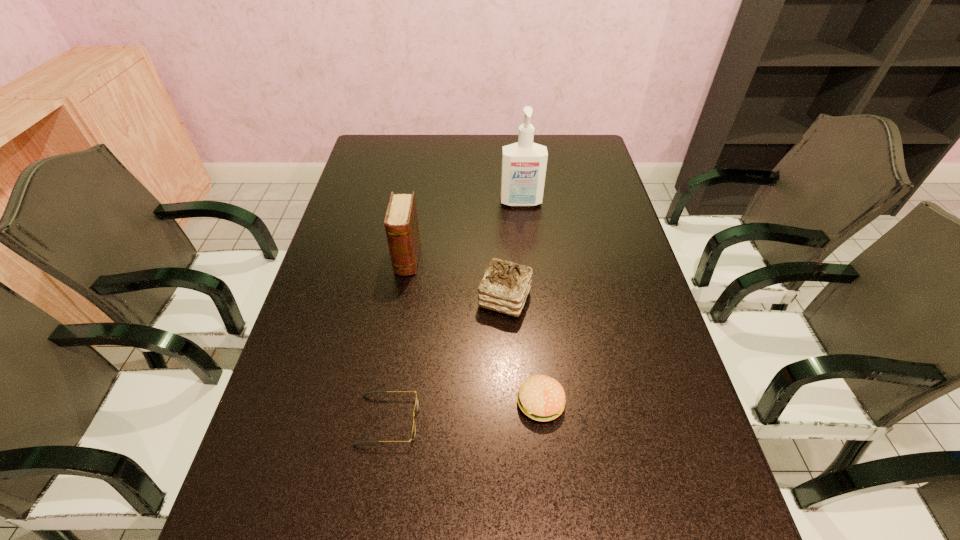
Where is `free space between the patty and the third nearest object`? free space between the patty and the third nearest object is located at coordinates pyautogui.click(x=522, y=350).

In order to click on vacant region between the fourth tallest object and the chocolate cake in this screenshot , I will do `click(522, 350)`.

I want to click on vacant space that is in between the shortest object and the patty, so click(464, 411).

You are a GUI agent. You are given a task and a screenshot of the screen. Output one action in this format:
    pyautogui.click(x=<x>, y=<y>)
    Task: Click on the vacant region between the second shortest object and the second farthest object
    Image resolution: width=960 pixels, height=540 pixels.
    Given the screenshot: What is the action you would take?
    pyautogui.click(x=474, y=330)

Where is `free space between the third nearest object and the fourth shortest object`? The height and width of the screenshot is (540, 960). free space between the third nearest object and the fourth shortest object is located at coordinates (456, 279).

Identify the location of free space between the diary and the patty. The width and height of the screenshot is (960, 540). [x=474, y=330].

Identify the location of vacant space in between the third tallest object and the second farthest object. The image size is (960, 540). (456, 279).

Identify the location of object identified as the third closest to the third farthest object. The width and height of the screenshot is (960, 540). (367, 393).

At what (x,y) coordinates should I click in order to perform the action: click on the fourth closest object relative to the third farthest object. Please return your answer as a coordinate pair (x, y). The image size is (960, 540). Looking at the image, I should click on (524, 163).

Identify the location of blank space that satisfies the following two spatial constraints: 1. on the front side of the patty; 2. on the right side of the chocolate cake. (510, 403).